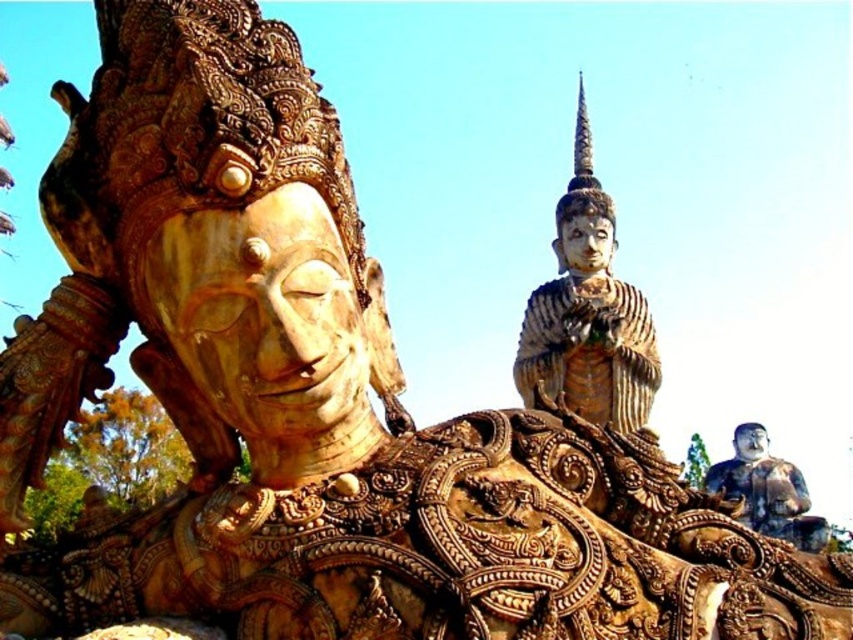
Is gold textured statue at center taller than polished bronze statue at lower right?

Yes.

Does gold textured statue at center come behind polished bronze statue at lower right?

That is True.

Does point (537, 289) come behind point (775, 528)?

Yes, point (537, 289) is farther from viewer.

Find the location of `gold textured statue at center`. gold textured statue at center is located at coordinates (587, 314).